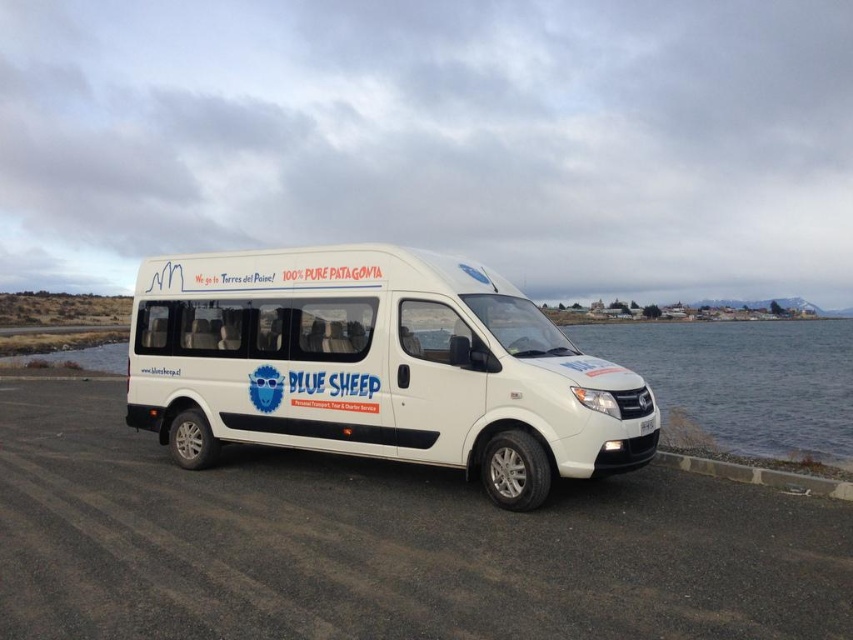
Question: Which is farther from the gray concrete curb at lower right?

Choices:
 (A) white matte van at center
 (B) transparent glass water at lower right

Answer: (B)

Question: Based on their relative distances, which object is farther from the white matte van at center?

Choices:
 (A) gray concrete curb at lower right
 (B) transparent glass water at lower right

Answer: (B)

Question: Where is white matte van at center located in relation to transparent glass water at lower right in the image?

Choices:
 (A) left
 (B) right

Answer: (A)

Question: Based on their relative distances, which object is farther from the white matte van at center?

Choices:
 (A) gray concrete curb at lower right
 (B) transparent glass water at lower right

Answer: (B)

Question: From the image, what is the correct spatial relationship of transparent glass water at lower right in relation to gray concrete curb at lower right?

Choices:
 (A) below
 (B) above

Answer: (B)

Question: Considering the relative positions of white matte van at center and transparent glass water at lower right in the image provided, where is white matte van at center located with respect to transparent glass water at lower right?

Choices:
 (A) above
 (B) below

Answer: (B)